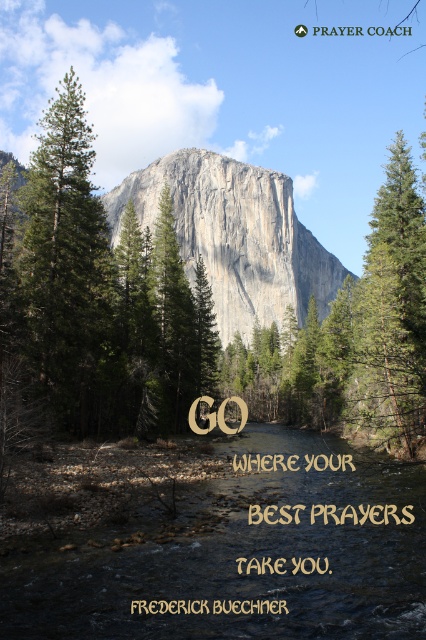
Question: Based on their relative distances, which object is farther from the green textured pine tree at left?

Choices:
 (A) gray rock mountain at center
 (B) clear water at center

Answer: (A)

Question: Does clear water at center appear under green textured pine tree at left?

Choices:
 (A) yes
 (B) no

Answer: (A)

Question: Can you confirm if clear water at center is positioned below green textured pine tree at left?

Choices:
 (A) yes
 (B) no

Answer: (A)

Question: Is clear water at center to the left of gray rock mountain at center from the viewer's perspective?

Choices:
 (A) yes
 (B) no

Answer: (A)

Question: Which point is farther to the camera?

Choices:
 (A) green textured pine tree at left
 (B) gray rock mountain at center

Answer: (B)

Question: Which point appears closest to the camera in this image?

Choices:
 (A) (51, 157)
 (B) (207, 557)

Answer: (B)